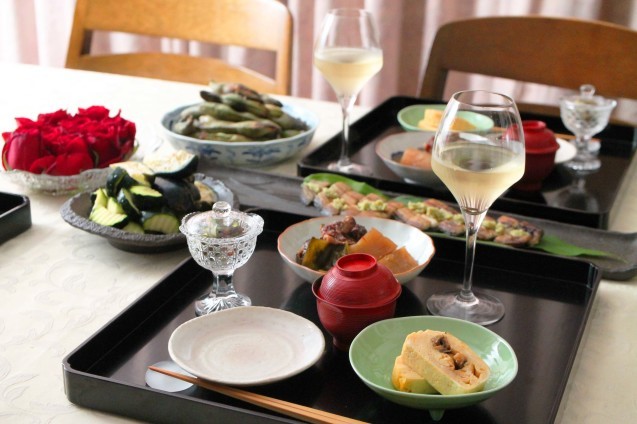
Locate an element on the screen. This screenshot has width=637, height=424. chop sticks is located at coordinates (313, 411), (567, 136).